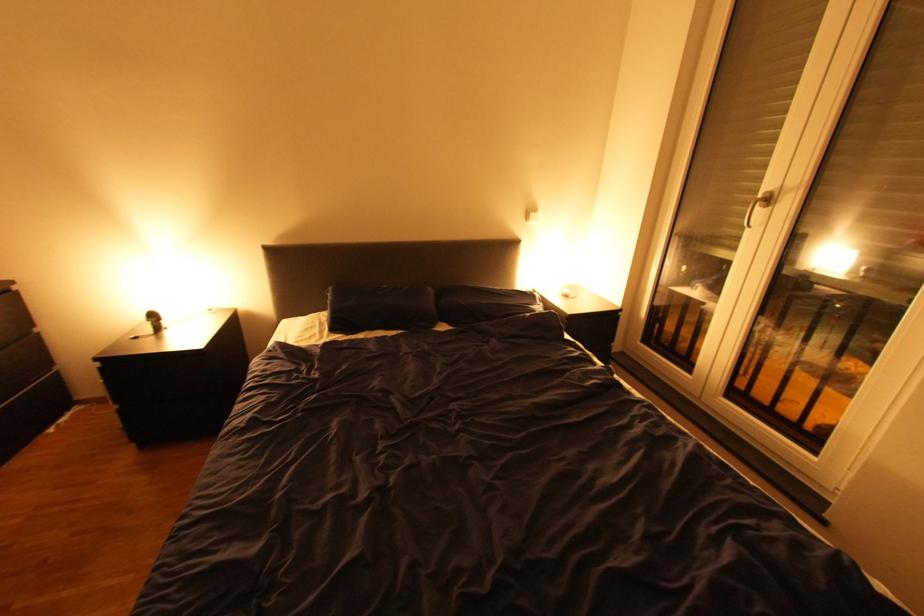
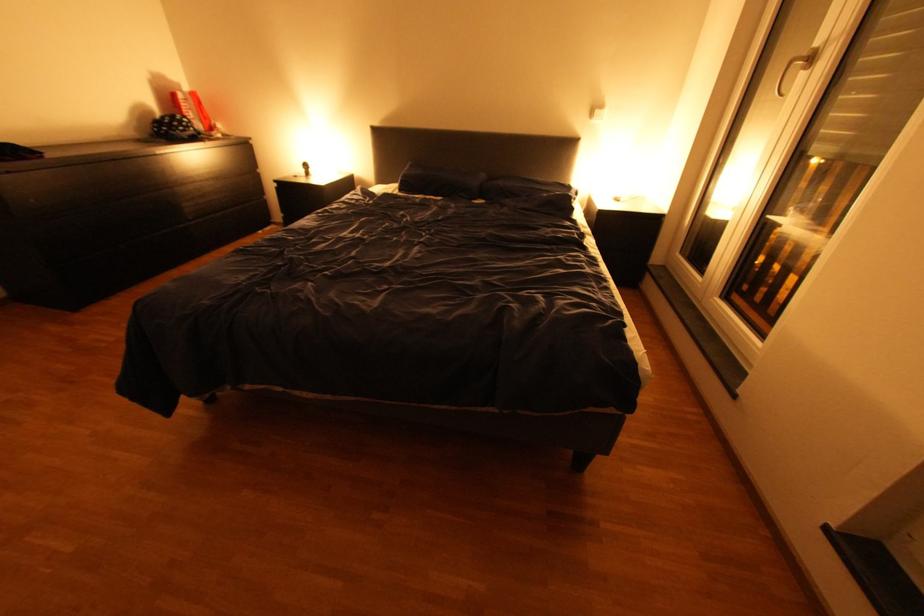
In a continuous first-person perspective shot, in which direction is the camera moving?

The movement direction of the cameraman is right, backward.